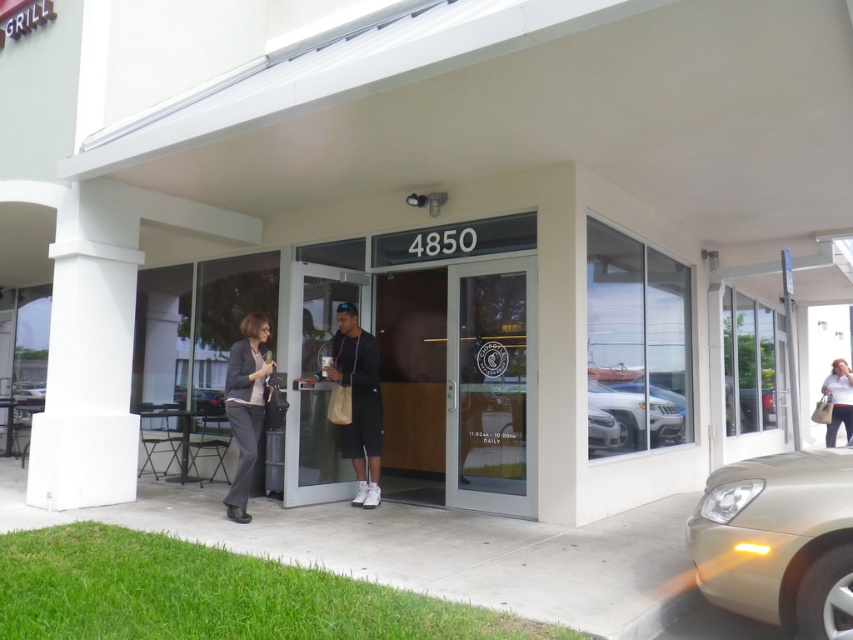
Can you confirm if matte black shorts at center is positioned above white matte car at center?

Correct, matte black shorts at center is located above white matte car at center.

Is matte black shorts at center shorter than white matte car at center?

No.

Is point (370, 371) positioned behind point (656, 426)?

That is False.

This screenshot has height=640, width=853. I want to click on matte black shorts at center, so click(x=358, y=401).

Is matte beige handbag at center wider than metallic silver car at lower left?

No, matte beige handbag at center is not wider than metallic silver car at lower left.

Which is in front, point (842, 358) or point (199, 412)?

Point (199, 412) is more forward.

Between point (845, 394) and point (175, 401), which one is positioned in front?

Point (175, 401)

You are a GUI agent. You are given a task and a screenshot of the screen. Output one action in this format:
    pyautogui.click(x=<x>, y=<y>)
    Task: Click on the matte beige handbag at center
    Image resolution: width=853 pixels, height=640 pixels.
    Given the screenshot: What is the action you would take?
    pyautogui.click(x=838, y=401)

Is white smooth column at left positioned before gold metallic car at lower right?

That is False.

Is white smooth column at left bigger than gold metallic car at lower right?

Correct, white smooth column at left is larger in size than gold metallic car at lower right.

Identify the location of white smooth column at left. The height and width of the screenshot is (640, 853). (90, 355).